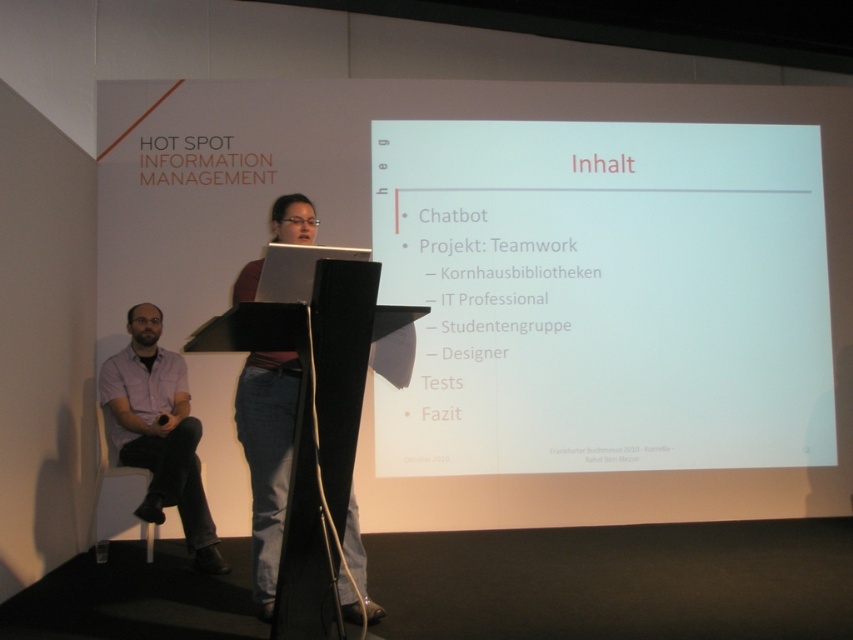
Consider the image. Who is lower down, white matte projector screen at center or purple shirt at left?

purple shirt at left is lower down.

Is white matte projector screen at center positioned behind purple shirt at left?

Yes, white matte projector screen at center is further from the viewer.

This screenshot has width=853, height=640. Find the location of `white matte projector screen at center`. white matte projector screen at center is located at coordinates (604, 296).

Where is `white matte projector screen at center`? white matte projector screen at center is located at coordinates (604, 296).